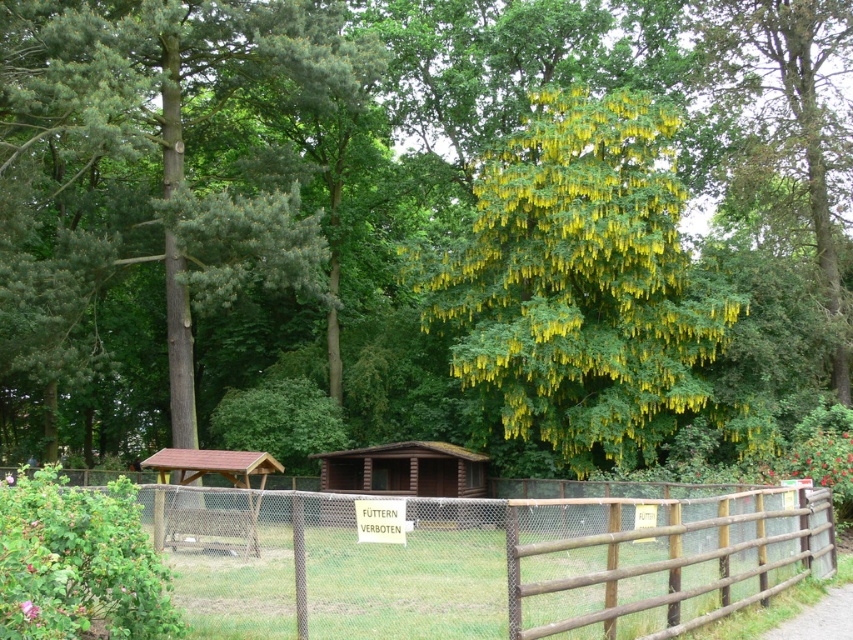
You are standing in the park and want to determine which of the two points, point (154,301) or point (849,624), is closer to you. Based on the scene description, which point is nearer?

Point (154,301) is closer to you because it is further to the viewer than point (849,624).